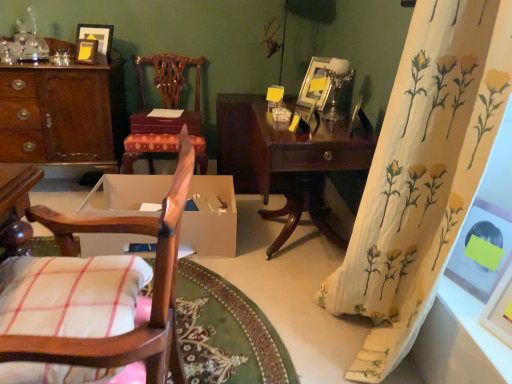
The height and width of the screenshot is (384, 512). Find the location of `free point to the left of matte yellow picture frame at right, the fourth picture frame positioned from the back`. free point to the left of matte yellow picture frame at right, the fourth picture frame positioned from the back is located at coordinates (444, 282).